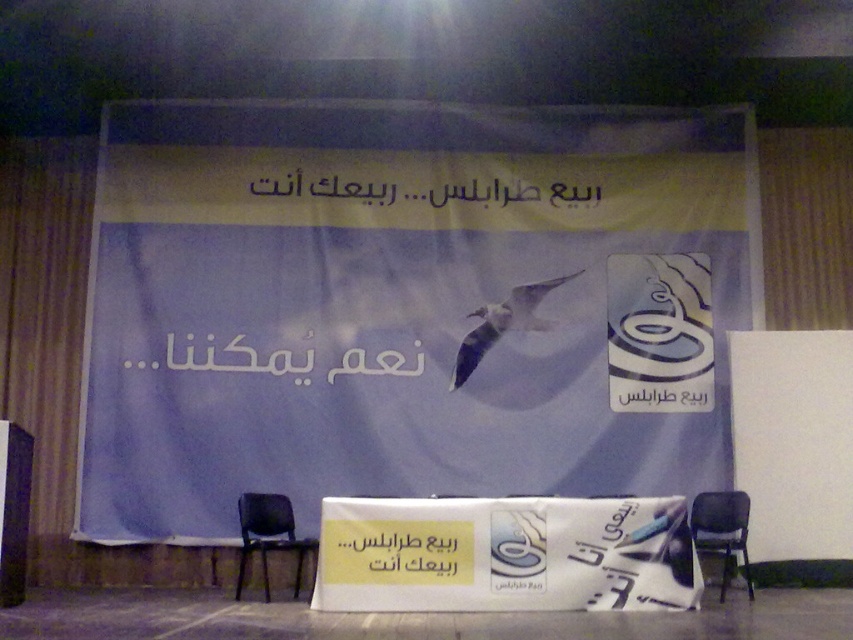
Measure the distance from white glossy banner at center to black plastic chair at lower left.

white glossy banner at center is 4.99 feet away from black plastic chair at lower left.

Is white glossy banner at center positioned in front of black plastic chair at lower left?

Yes, it is in front of black plastic chair at lower left.

Who is more distant from viewer, (474, 563) or (292, 540)?

The point (292, 540) is more distant.

Locate an element on the screen. This screenshot has height=640, width=853. white glossy banner at center is located at coordinates (505, 554).

Which is below, white glossy banner at center or white glossy bird at center?

Positioned lower is white glossy banner at center.

Is white glossy banner at center above white glossy bird at center?

No.

Is point (508, 611) farther from viewer compared to point (578, 273)?

That is False.

Find the location of a particular element. The image size is (853, 640). white glossy banner at center is located at coordinates (505, 554).

Which of these two, white glossy bird at center or black plastic chair at lower right, stands taller?

white glossy bird at center

Is white glossy bird at center above black plastic chair at lower right?

Indeed, white glossy bird at center is positioned over black plastic chair at lower right.

Measure the distance between point (486,332) and camera.

A distance of 7.93 meters exists between point (486,332) and camera.

This screenshot has height=640, width=853. I want to click on white glossy bird at center, so click(x=503, y=323).